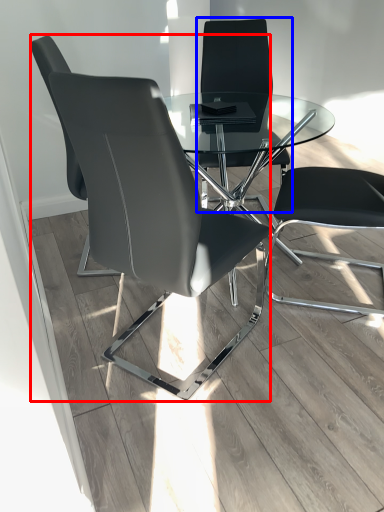
Question: Which object appears closest to the camera in this image, chair (highlighted by a red box) or chair (highlighted by a blue box)?

Choices:
 (A) chair
 (B) chair

Answer: (A)